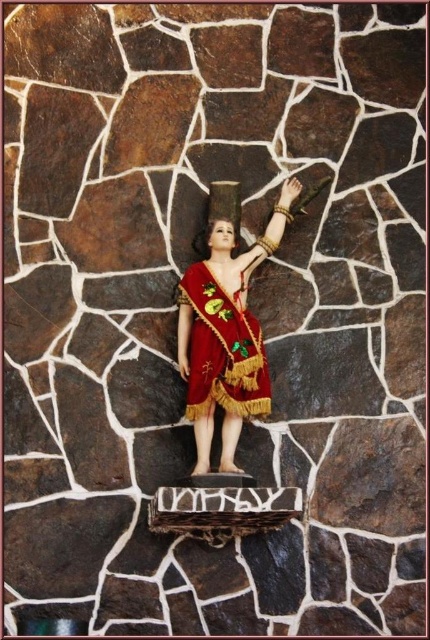
You are an art curator planning to display the shiny red fabric doll at center in a new exhibition. The exhibition requires all items to be placed precisely at the center point of their display area, which is at coordinate point 0.5, 0.5. Based on the image, is the doll currently positioned correctly for the exhibition requirements?

The shiny red fabric doll at center is located at point (226, 332), which is slightly off the required center point of (215, 320). Therefore, it is not positioned correctly for the exhibition requirements.

You are an archaeologist examining a figurine against a stone wall. You notice two points on the figurine labeled as point (233, 397) and point (202, 410). Which point is nearer to your eyes?

Point (233, 397) is closer to the viewer than point (202, 410).